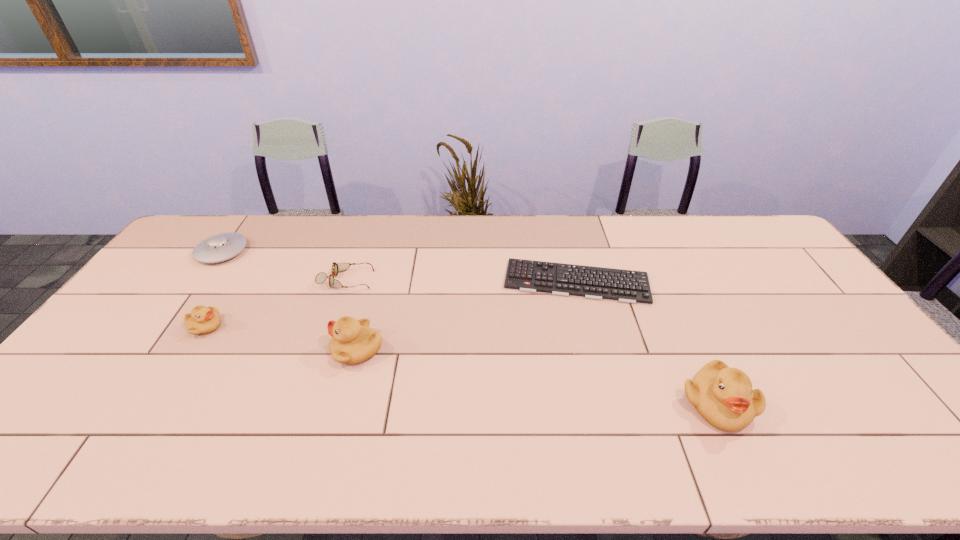
Image resolution: width=960 pixels, height=540 pixels. What are the coordinates of `free space at the far edge` in the screenshot? It's located at click(708, 251).

Where is `vacant space at the near edge of the desktop`? The height and width of the screenshot is (540, 960). vacant space at the near edge of the desktop is located at coordinates (576, 404).

Locate an element on the screen. vacant area at the left edge of the desktop is located at coordinates (94, 350).

The width and height of the screenshot is (960, 540). In the image, there is a desktop. Identify the location of vacant space at the right edge. (788, 274).

At what (x,y) coordinates should I click in order to perform the action: click on vacant space at the far right corner. Please return your answer as a coordinate pair (x, y). Image resolution: width=960 pixels, height=540 pixels. Looking at the image, I should click on (747, 243).

At what (x,y) coordinates should I click in order to perform the action: click on vacant space that's between the leftmost duckling and the third shortest object. Please return your answer as a coordinate pair (x, y). This screenshot has height=540, width=960. Looking at the image, I should click on (214, 289).

Locate an element on the screen. This screenshot has height=540, width=960. vacant space that's between the spectacles and the saucer is located at coordinates (284, 266).

At what (x,y) coordinates should I click in order to perform the action: click on vacant space that's between the spectacles and the third tallest object. Please return your answer as a coordinate pair (x, y). Looking at the image, I should click on (276, 303).

Identify the location of vacant area that lies between the fifth tallest object and the shortest object. pos(462,281).

At what (x,y) coordinates should I click in order to perform the action: click on vacant space in between the fourth shortest object and the spectacles. Please return your answer as a coordinate pair (x, y). The width and height of the screenshot is (960, 540). Looking at the image, I should click on (276, 303).